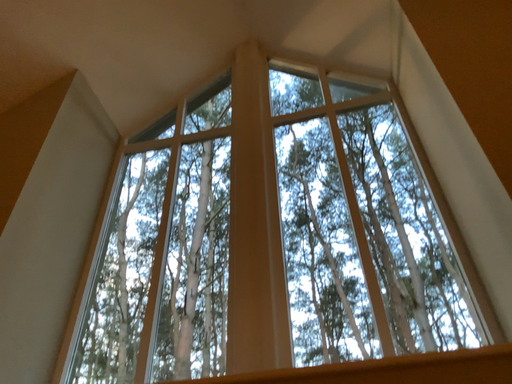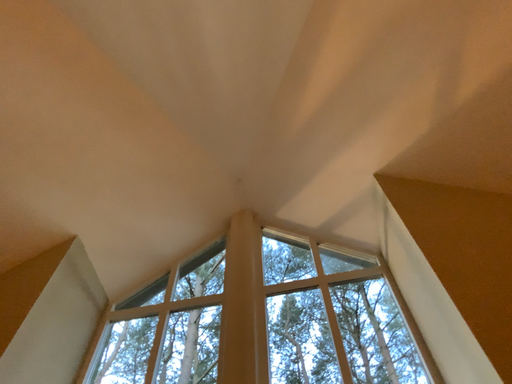
Question: How did the camera likely rotate when shooting the video?

Choices:
 (A) rotated upward
 (B) rotated downward

Answer: (A)